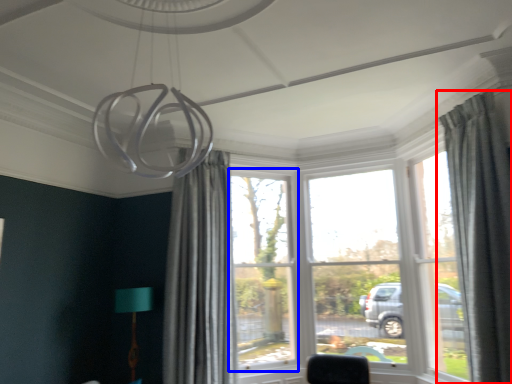
Question: Which object appears farthest to the camera in this image, curtain (highlighted by a red box) or window (highlighted by a blue box)?

Choices:
 (A) curtain
 (B) window

Answer: (B)